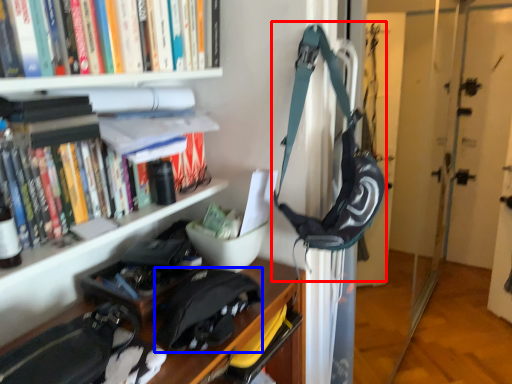
Question: Which object is further to the camera taking this photo, shoulder bag (highlighted by a red box) or messenger bag (highlighted by a blue box)?

Choices:
 (A) shoulder bag
 (B) messenger bag

Answer: (A)